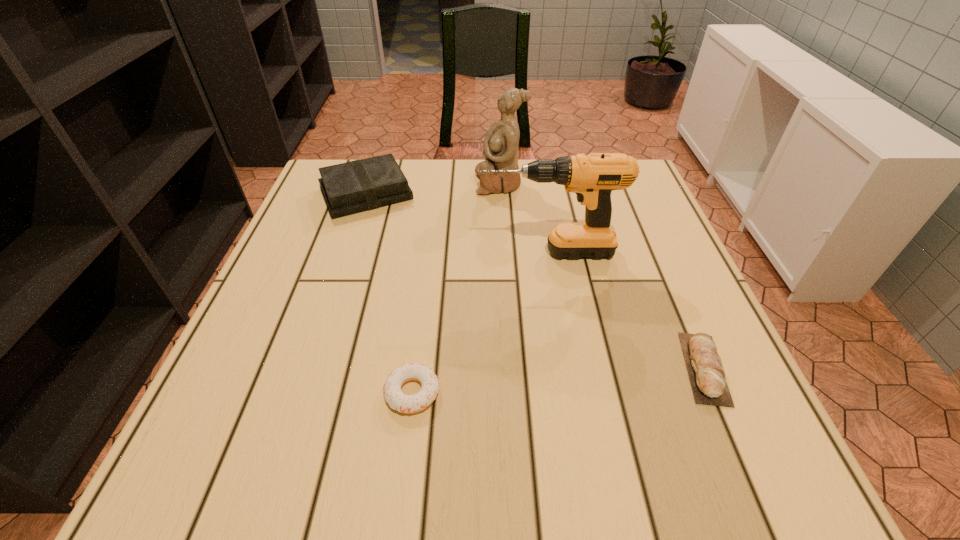
The image size is (960, 540). What are the coordinates of `drill that is at the right edge` in the screenshot? It's located at (593, 177).

Where is `pita bread that is at the right edge`? This screenshot has width=960, height=540. pita bread that is at the right edge is located at coordinates (707, 376).

Identify the location of object at the far left corner. This screenshot has width=960, height=540. (355, 186).

You are a GUI agent. You are given a task and a screenshot of the screen. Output one action in this format:
    pyautogui.click(x=<x>, y=<y>)
    Task: Click on the vacant area at the far edge
    
    Given the screenshot: What is the action you would take?
    pyautogui.click(x=466, y=196)

Locate an element on the screen. This screenshot has width=960, height=540. vacant area at the left edge is located at coordinates (345, 280).

Where is `vacant region at the right edge of the desktop`? vacant region at the right edge of the desktop is located at coordinates (652, 289).

In the image, there is a desktop. Identify the location of vacant space at the far right corner. This screenshot has width=960, height=540. (641, 205).

The height and width of the screenshot is (540, 960). In the image, there is a desktop. In order to click on vacant area at the near right corner in this screenshot , I will do `click(769, 462)`.

The image size is (960, 540). I want to click on vacant space that is in between the figurine and the third farthest object, so click(523, 218).

Where is `vacant area that lies between the book and the figurine`? vacant area that lies between the book and the figurine is located at coordinates (433, 188).